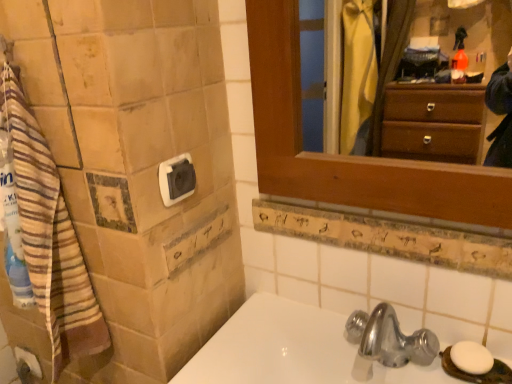
Question: Is white glossy sink at lower center at the right side of brown striped towel at left?

Choices:
 (A) no
 (B) yes

Answer: (B)

Question: From the image's perspective, would you say white glossy sink at lower center is shown under brown striped towel at left?

Choices:
 (A) yes
 (B) no

Answer: (A)

Question: Can you confirm if white glossy sink at lower center is thinner than brown striped towel at left?

Choices:
 (A) no
 (B) yes

Answer: (A)

Question: Is white glossy sink at lower center wider than brown striped towel at left?

Choices:
 (A) no
 (B) yes

Answer: (B)

Question: From a real-world perspective, is white glossy sink at lower center under brown striped towel at left?

Choices:
 (A) no
 (B) yes

Answer: (B)

Question: Considering the relative sizes of white glossy sink at lower center and brown striped towel at left in the image provided, is white glossy sink at lower center smaller than brown striped towel at left?

Choices:
 (A) yes
 (B) no

Answer: (B)

Question: Considering the relative sizes of brown striped towel at left and wooden frame at upper right in the image provided, is brown striped towel at left bigger than wooden frame at upper right?

Choices:
 (A) no
 (B) yes

Answer: (B)

Question: Would you say brown striped towel at left is outside wooden frame at upper right?

Choices:
 (A) yes
 (B) no

Answer: (A)

Question: Is wooden frame at upper right surrounded by brown striped towel at left?

Choices:
 (A) yes
 (B) no

Answer: (B)

Question: From the image's perspective, is brown striped towel at left located beneath wooden frame at upper right?

Choices:
 (A) yes
 (B) no

Answer: (A)

Question: Does brown striped towel at left appear on the right side of wooden frame at upper right?

Choices:
 (A) yes
 (B) no

Answer: (B)

Question: Does brown striped towel at left have a lesser width compared to wooden frame at upper right?

Choices:
 (A) no
 (B) yes

Answer: (A)

Question: Does white plastic towel bar at upper left appear on the left side of white glossy sink at lower center?

Choices:
 (A) no
 (B) yes

Answer: (B)